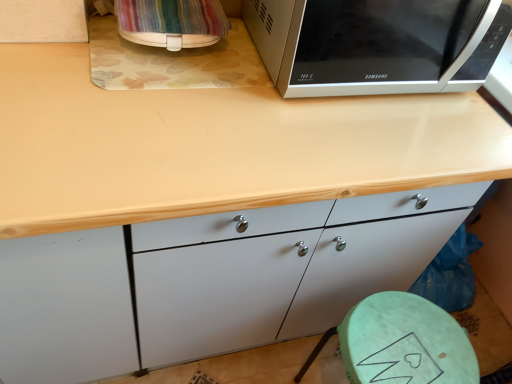
Where is `free location above wooden at upper center (from a real-world perspective)`? free location above wooden at upper center (from a real-world perspective) is located at coordinates (185, 99).